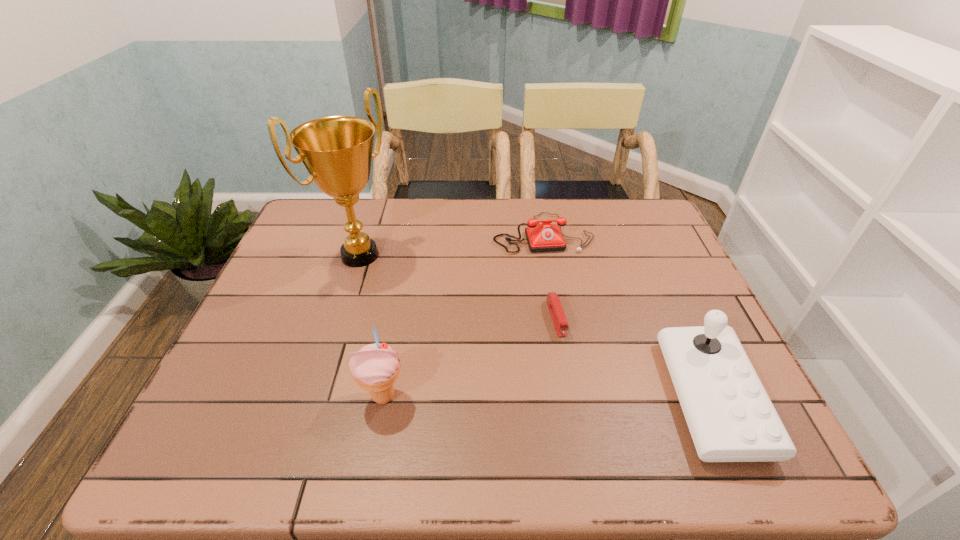
This screenshot has width=960, height=540. Identify the location of icecream. (375, 367).

Find the location of a particular element. The width and height of the screenshot is (960, 540). the rightmost object is located at coordinates (730, 416).

Where is `award`? This screenshot has height=540, width=960. award is located at coordinates (337, 151).

This screenshot has height=540, width=960. In order to click on telephone in this screenshot , I will do `click(545, 237)`.

Identify the location of the third nearest object. The image size is (960, 540). (555, 308).

In order to click on stapler in this screenshot , I will do `click(555, 308)`.

You are a GUI agent. You are given a task and a screenshot of the screen. Output one action in this format:
    pyautogui.click(x=<x>, y=<y>)
    Task: Click on the blank area located on the back of the icecream
    The image size is (960, 540).
    Given the screenshot: What is the action you would take?
    pyautogui.click(x=406, y=274)

I want to click on free region located 0.340m on the back of the joystick, so click(x=647, y=252).

Locate an element on the screen. Image resolution: width=960 pixels, height=540 pixels. vacant space situated on the front view with handles of the tallest object is located at coordinates (397, 284).

This screenshot has height=540, width=960. I want to click on vacant space situated on the front view with handles of the tallest object, so click(x=419, y=301).